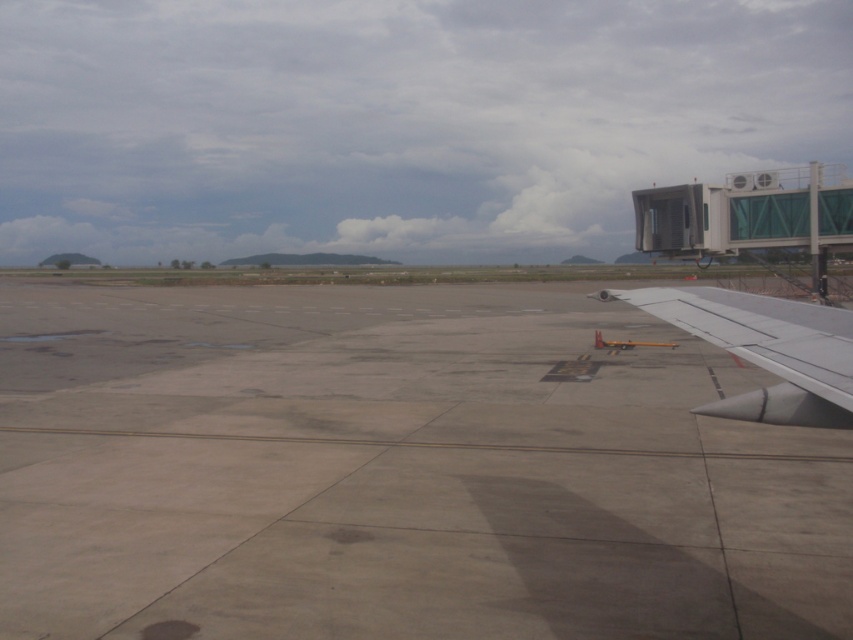
You are a maintenance worker needing to move a heavy equipment from the terminal to the aircraft. The equipment requires a path wider than the silver metallic wing at lower right. Can the gray concrete tarmac at center accommodate this requirement?

The gray concrete tarmac at center might be wider than the silver metallic wing at lower right, so it could potentially accommodate the equipment if the width is sufficient. However, the exact width isn

You are a maintenance worker needing to reach the gray concrete tarmac at center from the silver metallic wing at lower right. Can you walk directly between them without any obstacles?

The distance between the gray concrete tarmac at center and the silver metallic wing at lower right is 21.45 feet. Since there are no mentioned obstacles in the scene description, you can walk directly between them.